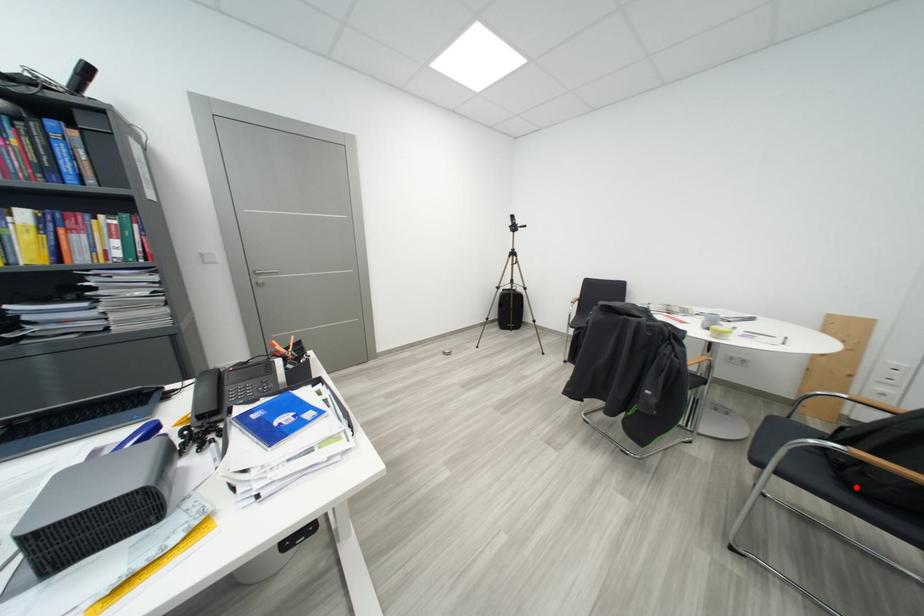
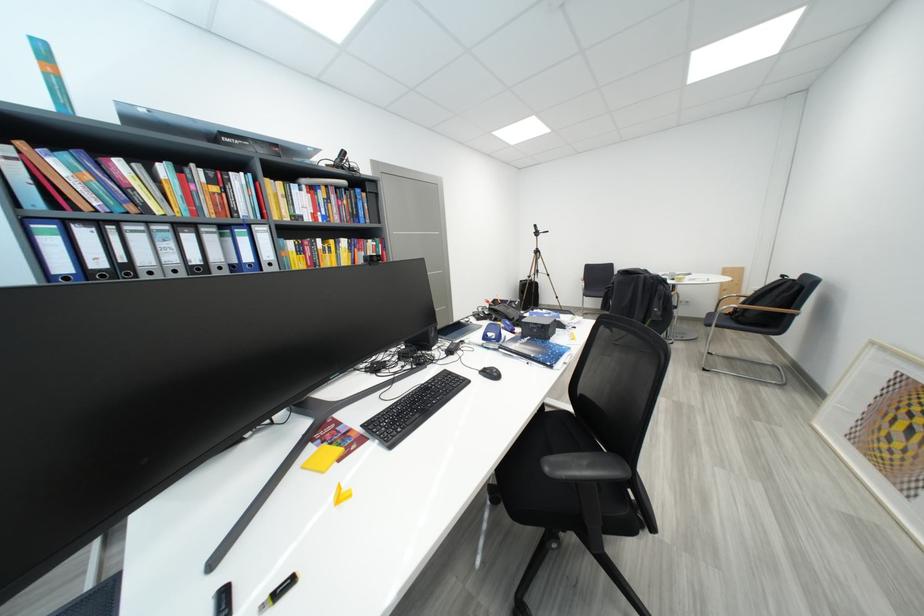
Locate, in the second image, the point that corresponds to the highlighted location in the first image.

(748, 325)